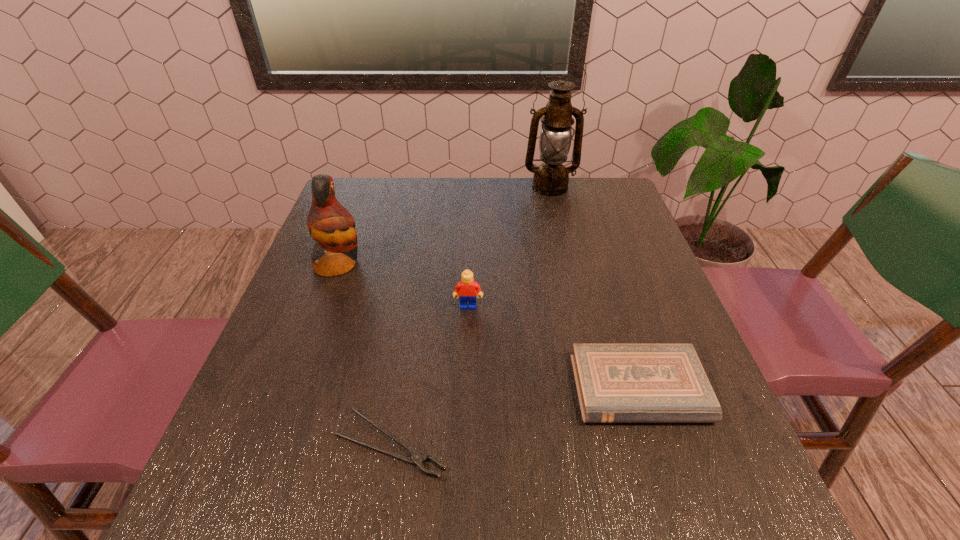
Image resolution: width=960 pixels, height=540 pixels. I want to click on free spot between the third shortest object and the oil lamp, so click(x=509, y=247).

You are a GUI agent. You are given a task and a screenshot of the screen. Output one action in this format:
    pyautogui.click(x=<x>, y=<y>)
    Task: Click on the empty location between the shortest object and the leftmost object
    This screenshot has width=960, height=540.
    Given the screenshot: What is the action you would take?
    pyautogui.click(x=365, y=354)

This screenshot has width=960, height=540. I want to click on empty location between the second shortest object and the parrot, so click(489, 327).

Locate an element on the screen. free space between the oil lamp and the tongs is located at coordinates (470, 316).

I want to click on free space that is in between the shortest object and the fourth nearest object, so click(x=365, y=354).

Locate which object ranks second in proximity to the second tallest object. Please provide its 2D coordinates. Your answer should be formatted as a tuple, i.e. [(x, y)], where the tuple contains the x and y coordinates of a point satisfying the conditions above.

[(416, 458)]

Identify which object is the second closest to the leftmost object. Please provide its 2D coordinates. Your answer should be formatted as a tuple, i.e. [(x, y)], where the tuple contains the x and y coordinates of a point satisfying the conditions above.

[(416, 458)]

Locate an element on the screen. Image resolution: width=960 pixels, height=540 pixels. free space that satisfies the following two spatial constraints: 1. on the front side of the tallest object; 2. on the face of the fourth shortest object is located at coordinates (567, 265).